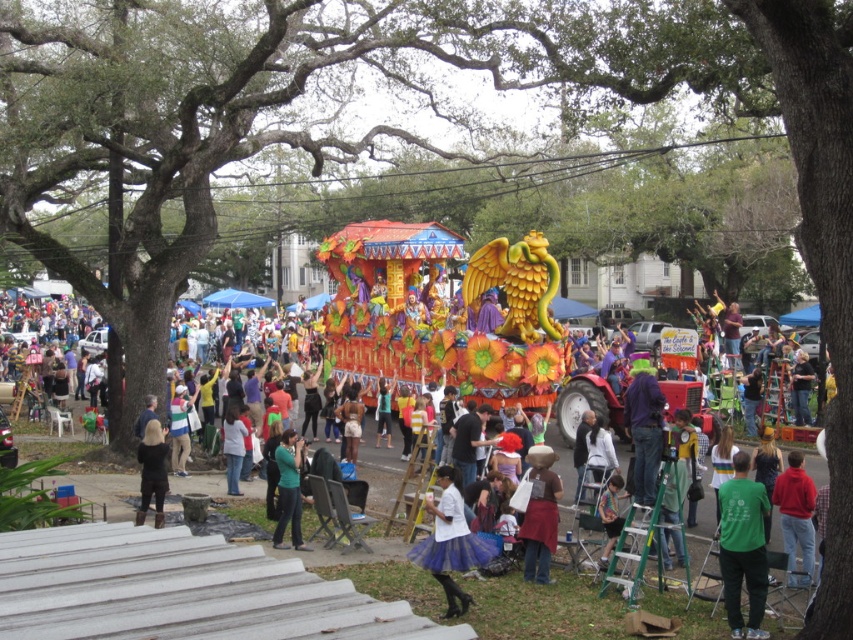
Does point (438, 524) come closer to viewer compared to point (538, 483)?

Yes.

Does point (445, 508) come farther from viewer compared to point (531, 554)?

No, (445, 508) is in front of (531, 554).

What do you see at coordinates (450, 541) in the screenshot? I see `white cotton shirt at center` at bounding box center [450, 541].

Identify the location of white cotton shirt at center. The height and width of the screenshot is (640, 853). (450, 541).

Is green matte shirt at lower right to the left of black fabric at lower left from the viewer's perspective?

In fact, green matte shirt at lower right is to the right of black fabric at lower left.

Locate an element on the screen. Image resolution: width=853 pixels, height=640 pixels. green matte shirt at lower right is located at coordinates (743, 547).

Does brown fabric hat at center appear under black fabric at lower left?

Yes, brown fabric hat at center is below black fabric at lower left.

Is point (561, 490) more distant than point (157, 481)?

No, it is not.

Locate an element on the screen. The height and width of the screenshot is (640, 853). brown fabric hat at center is located at coordinates (540, 515).